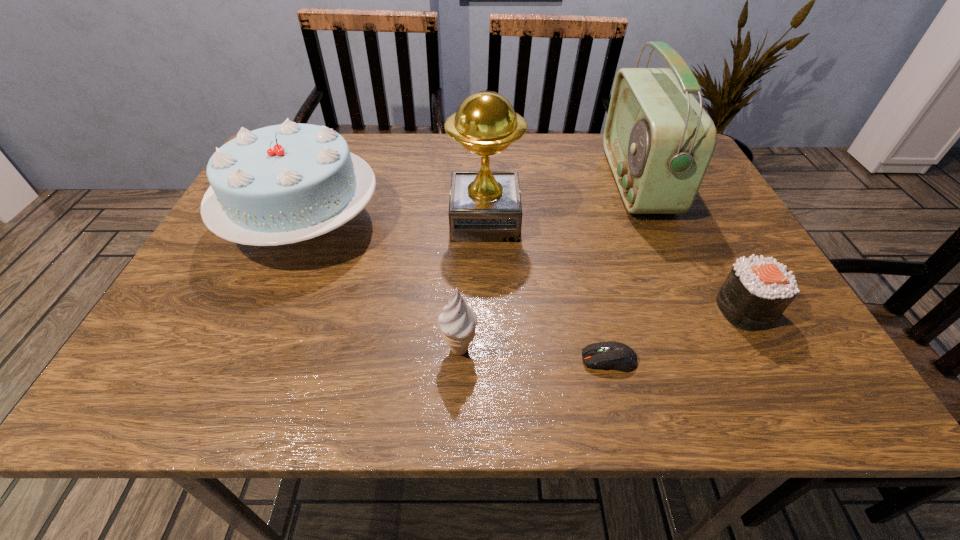
The image size is (960, 540). I want to click on radio receiver, so click(x=659, y=141).

Find the location of a particular element. award is located at coordinates (485, 206).

Where is `the third tallest object`? Image resolution: width=960 pixels, height=540 pixels. the third tallest object is located at coordinates (281, 184).

Image resolution: width=960 pixels, height=540 pixels. I want to click on the leftmost object, so click(281, 184).

Find the location of a particular element. icecream is located at coordinates (458, 321).

At what (x,y) coordinates should I click in order to perform the action: click on the third nearest object. Please return your answer as a coordinate pair (x, y). This screenshot has height=540, width=960. Looking at the image, I should click on (757, 291).

This screenshot has height=540, width=960. In order to click on the second shortest object in this screenshot , I will do `click(757, 291)`.

At what (x,y) coordinates should I click in order to perform the action: click on the fourth object from left to right. Please return your answer as a coordinate pair (x, y). Image resolution: width=960 pixels, height=540 pixels. Looking at the image, I should click on (617, 356).

At what (x,y) coordinates should I click in order to perform the action: click on the shortest object. Please return your answer as a coordinate pair (x, y). The height and width of the screenshot is (540, 960). Looking at the image, I should click on (617, 356).

In order to click on vacant space situated 0.060m on the front panel of the radio receiver in this screenshot , I will do `click(588, 181)`.